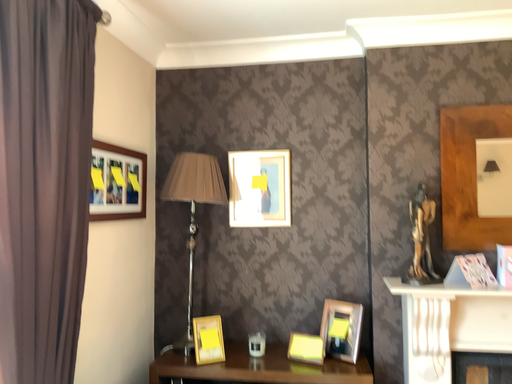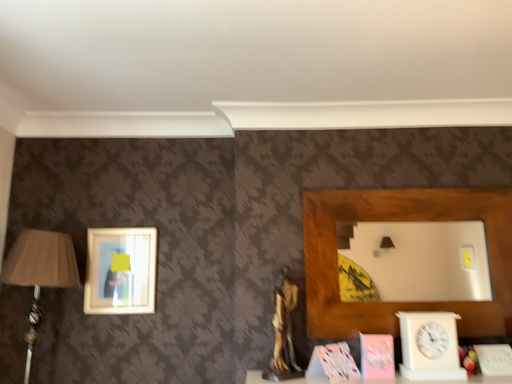
Question: Which way did the camera rotate in the video?

Choices:
 (A) rotated right
 (B) rotated left

Answer: (A)